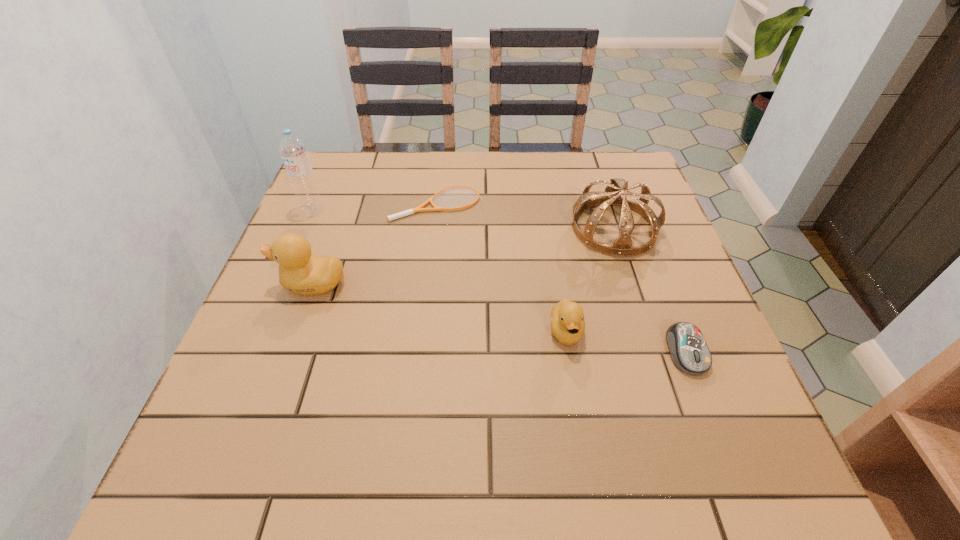
This screenshot has width=960, height=540. What are the coordinates of `vacant space at the left edge` in the screenshot? It's located at (289, 344).

This screenshot has height=540, width=960. What are the coordinates of `free spot at the right edge of the desktop` in the screenshot? It's located at (630, 303).

Image resolution: width=960 pixels, height=540 pixels. In the image, there is a desktop. What are the coordinates of `vacant space at the far left corner` in the screenshot? It's located at (363, 185).

Where is `vacant area at the near left corner of the desktop`? The width and height of the screenshot is (960, 540). vacant area at the near left corner of the desktop is located at coordinates (300, 393).

Where is `free space at the near right corner of the desktop`? This screenshot has width=960, height=540. free space at the near right corner of the desktop is located at coordinates (737, 418).

This screenshot has width=960, height=540. I want to click on vacant space in between the tennis racket and the computer mouse, so click(562, 277).

Locate an element on the screen. Image resolution: width=960 pixels, height=540 pixels. vacant area between the left duckling and the shortest object is located at coordinates (374, 244).

Locate an element on the screen. Image resolution: width=960 pixels, height=540 pixels. vacant region between the nearer duckling and the fifth tallest object is located at coordinates coord(626,342).

At what (x,y) coordinates should I click in order to perform the action: click on free space between the taller duckling and the shortest object. Please return your answer as a coordinate pair (x, y). The height and width of the screenshot is (540, 960). Looking at the image, I should click on (374, 244).

I want to click on unoccupied position between the tiara and the nearer duckling, so click(590, 280).